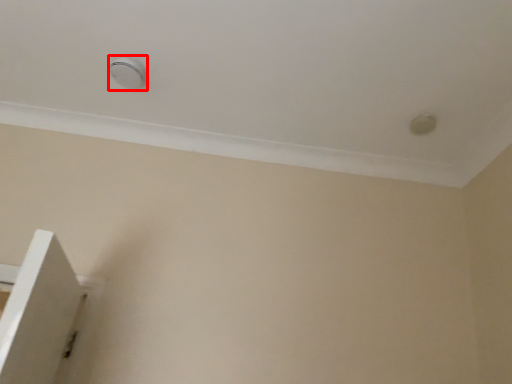
Question: From the image, what is the correct spatial relationship of knob (annotated by the red box) in relation to knob?

Choices:
 (A) right
 (B) left

Answer: (B)